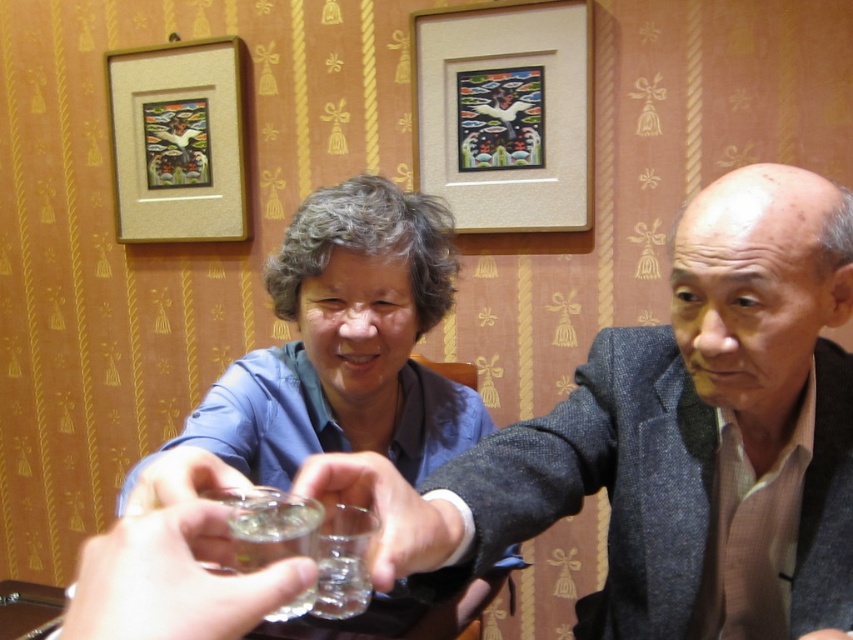
Is blue fabric shirt at center to the right of clear glass at center from the viewer's perspective?

Incorrect, blue fabric shirt at center is not on the right side of clear glass at center.

Does blue fabric shirt at center have a smaller size compared to clear glass at center?

Incorrect, blue fabric shirt at center is not smaller in size than clear glass at center.

Is point (252, 465) positioned behind point (281, 540)?

Yes, it is.

Image resolution: width=853 pixels, height=640 pixels. Identify the location of blue fabric shirt at center. (335, 352).

Can you confirm if gray wool suit at center is positioned to the left of wooden frame at upper center?

In fact, gray wool suit at center is to the right of wooden frame at upper center.

Who is lower down, gray wool suit at center or wooden frame at upper center?

gray wool suit at center is below.

Between point (769, 416) and point (548, 8), which one is positioned behind?

Point (548, 8)

Find the location of a particular element. This screenshot has height=640, width=853. gray wool suit at center is located at coordinates (664, 420).

Which of these two, gray wool suit at center or clear glass at center, stands shorter?

clear glass at center

Find the location of a particular element. The width and height of the screenshot is (853, 640). gray wool suit at center is located at coordinates (664, 420).